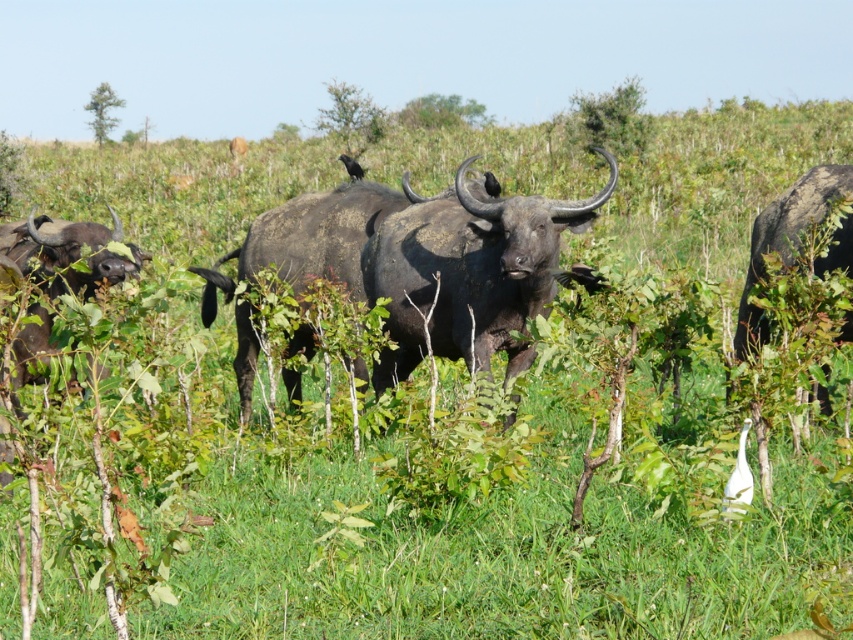
Question: Which of these objects is positioned closest to the dark brown horned bull at right?

Choices:
 (A) shiny dark brown bull at center
 (B) black matte yak at center

Answer: (A)

Question: Considering the real-world distances, which object is farthest from the dark brown horned bull at right?

Choices:
 (A) shiny dark brown bull at center
 (B) black matte yak at center

Answer: (B)

Question: Is shiny dark brown bull at center to the left of dark brown horned bull at right from the viewer's perspective?

Choices:
 (A) yes
 (B) no

Answer: (A)

Question: Can you confirm if shiny dark brown bull at center is wider than dark brown horned bull at right?

Choices:
 (A) yes
 (B) no

Answer: (A)

Question: Is shiny dark brown bull at center closer to camera compared to black matte yak at center?

Choices:
 (A) yes
 (B) no

Answer: (A)

Question: Estimate the real-world distances between objects in this image. Which object is farther from the shiny dark brown bull at center?

Choices:
 (A) black matte yak at center
 (B) dark brown horned bull at right

Answer: (B)